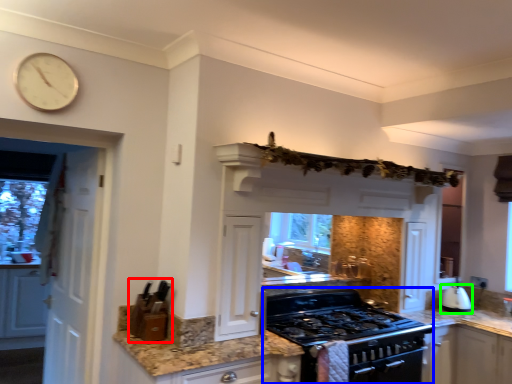
Question: Which object is positioned closest to appliance (highlighted by a red box)? Select from appliance (highlighted by a blue box) and kitchen appliance (highlighted by a green box).

Choices:
 (A) appliance
 (B) kitchen appliance

Answer: (A)